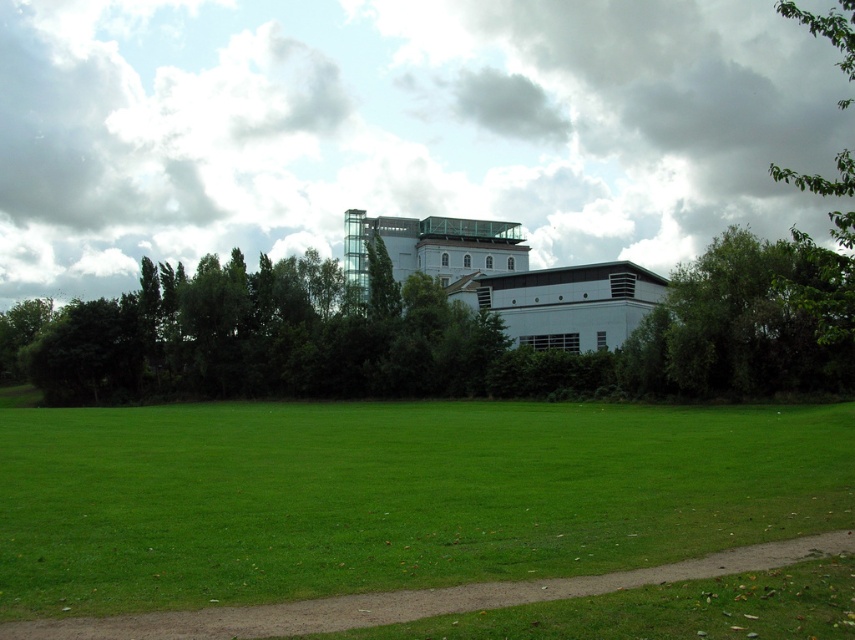
Can you confirm if green grass at lower center is bigger than green leafy tree at upper right?

Actually, green grass at lower center might be smaller than green leafy tree at upper right.

Between green grass at lower center and green leafy tree at upper right, which one appears on the right side from the viewer's perspective?

Positioned to the right is green leafy tree at upper right.

Identify the location of green grass at lower center. The width and height of the screenshot is (855, 640). (392, 496).

Identify the location of green grass at lower center. (392, 496).

Between green grass at lower center and brown dirt path at lower center, which one appears on the right side from the viewer's perspective?

From the viewer's perspective, brown dirt path at lower center appears more on the right side.

Can you confirm if green grass at lower center is positioned to the right of brown dirt path at lower center?

Incorrect, green grass at lower center is not on the right side of brown dirt path at lower center.

The image size is (855, 640). In order to click on green grass at lower center in this screenshot , I will do `click(392, 496)`.

The height and width of the screenshot is (640, 855). Find the location of `green grass at lower center`. green grass at lower center is located at coordinates (392, 496).

Does brown dirt path at lower center have a smaller size compared to green leafy tree at upper right?

Yes.

This screenshot has height=640, width=855. Find the location of `brown dirt path at lower center`. brown dirt path at lower center is located at coordinates (416, 600).

Locate an element on the screen. brown dirt path at lower center is located at coordinates (416, 600).

Where is `brown dirt path at lower center`? The width and height of the screenshot is (855, 640). brown dirt path at lower center is located at coordinates (416, 600).